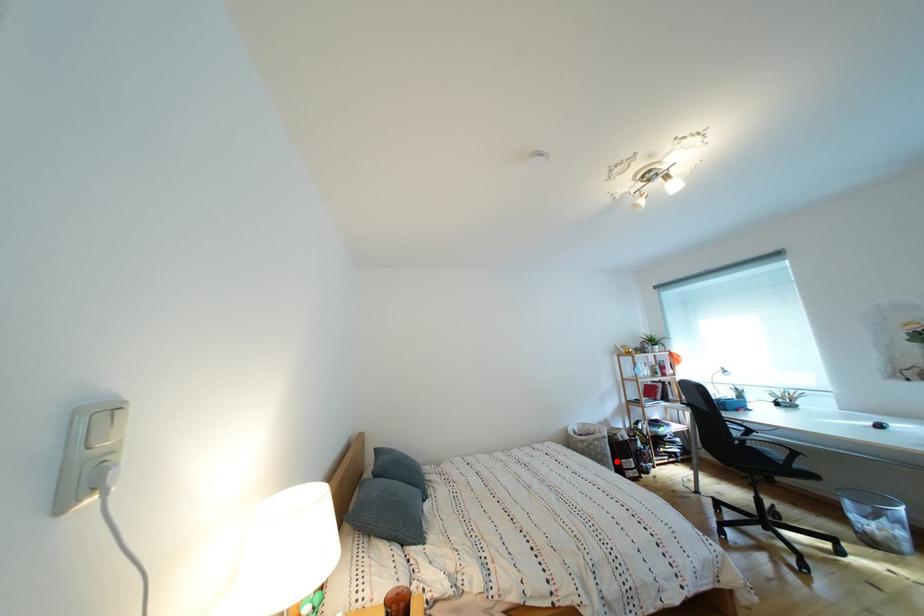
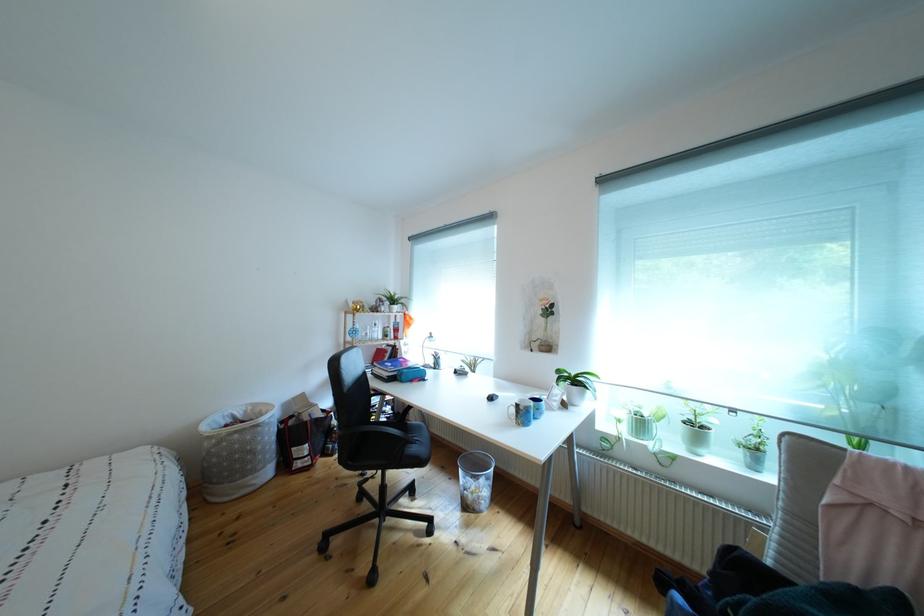
Question: I am providing you with two images of the same scene from different viewpoints. Image1 has a red point marked. In image2, the corresponding 3D location appears at what relative position? Reply with the corresponding letter.

Choices:
 (A) Closer
 (B) Farther

Answer: (A)